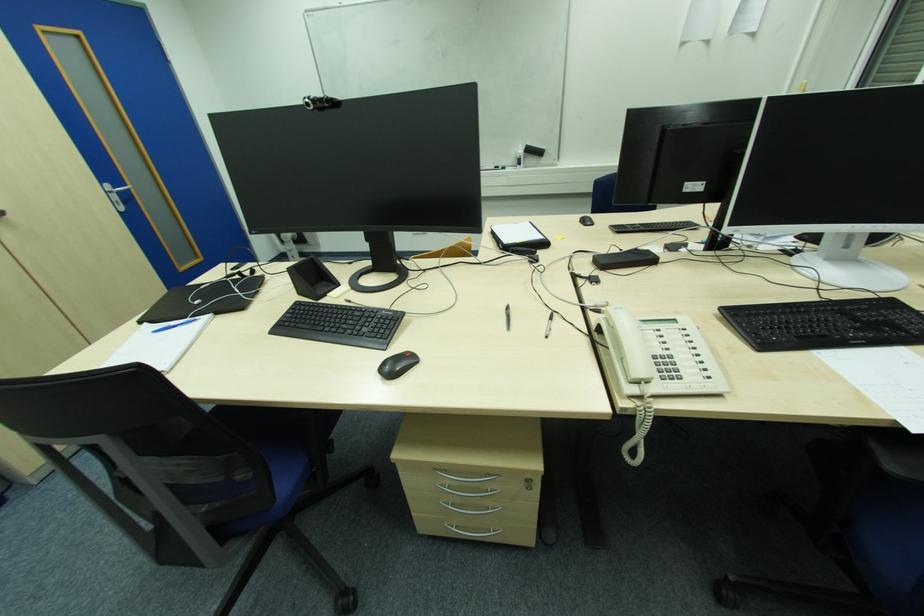
Describe the element at coordinates (116, 195) in the screenshot. I see `the silver door handle` at that location.